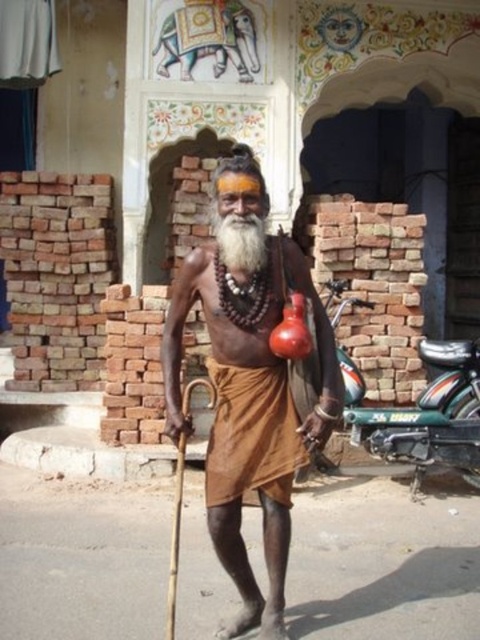
The elderly man in the scene is holding a wooden staff and a red gourd. Based on the description, which object is positioned lower on his body, the brown matte cloth at center or the white matte beard at center?

The brown matte cloth at center is positioned below the white matte beard at center, so the brown matte cloth at center is lower on the man.

You are a photographer standing 5 feet away from the elderly man. You want to take a closeup photo of the brown matte cloth at center and brown cotton dhoti at center. Can you fit both items in the frame of your camera which has a maximum width of 5 inches?

The brown matte cloth at center and brown cotton dhoti at center are 4.70 inches apart. Since the distance between them is less than the camera frame width of 5 inches, both items can fit within the frame.